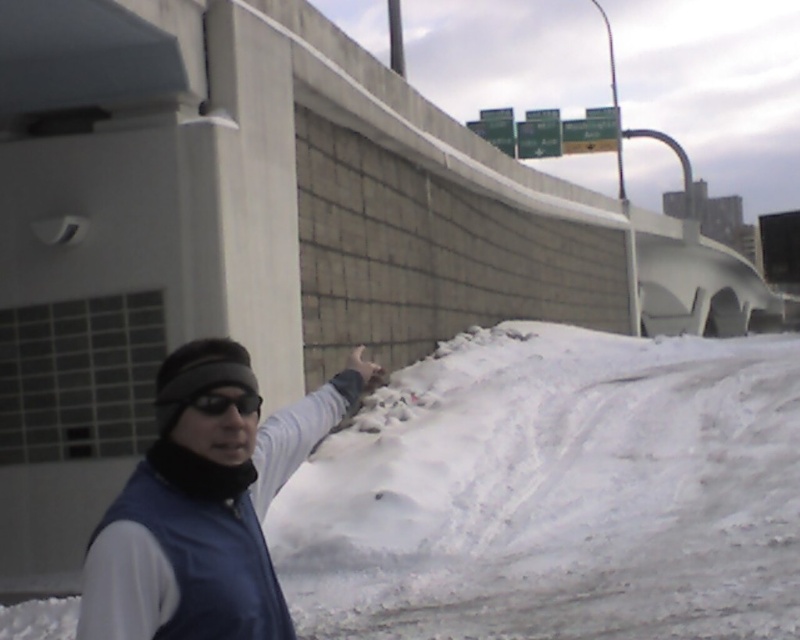
Question: Does blue fabric jacket at center appear over black matte goggles at upper left?

Choices:
 (A) yes
 (B) no

Answer: (B)

Question: Is the position of white fluffy snow at right less distant than that of blue fabric jacket at center?

Choices:
 (A) yes
 (B) no

Answer: (B)

Question: Which object is the farthest from the black matte goggles at upper left?

Choices:
 (A) blue fabric jacket at center
 (B) white fluffy snow at right
 (C) white matte hand at upper right

Answer: (B)

Question: Is white fluffy snow at right to the right of black matte goggles at upper left from the viewer's perspective?

Choices:
 (A) no
 (B) yes

Answer: (B)

Question: Among these points, which one is nearest to the camera?

Choices:
 (A) (168, 612)
 (B) (772, 456)

Answer: (A)

Question: Which object is positioned farthest from the white matte hand at upper right?

Choices:
 (A) white fluffy snow at right
 (B) black matte goggles at upper left

Answer: (A)